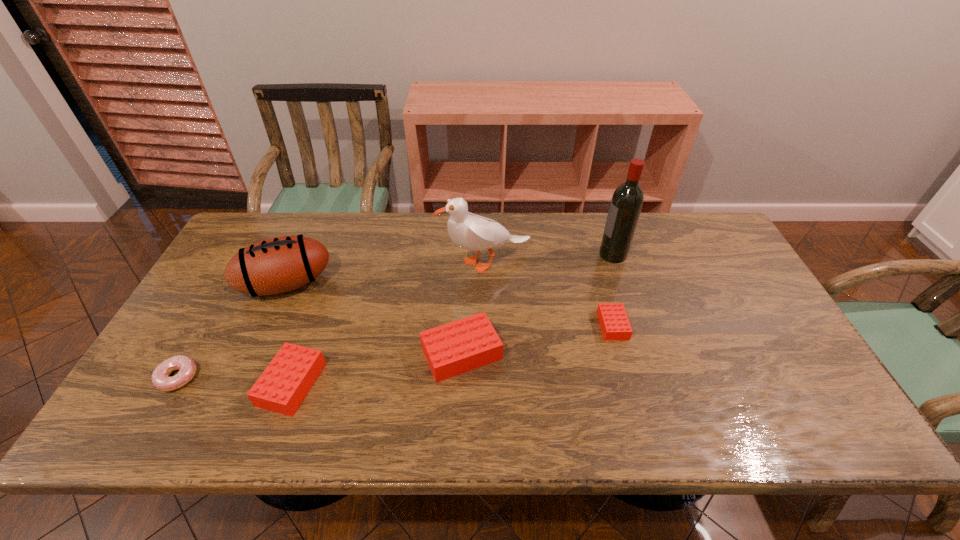
The height and width of the screenshot is (540, 960). What are the coordinates of `the fifth tallest object` in the screenshot? It's located at (281, 388).

Where is `the second tallest Lego`? The width and height of the screenshot is (960, 540). the second tallest Lego is located at coordinates (281, 388).

Identify the location of the second Lego from right to left. Image resolution: width=960 pixels, height=540 pixels. (457, 347).

Identify the location of the rightmost Lego. (614, 322).

Where is `gull`? The image size is (960, 540). gull is located at coordinates (469, 231).

Locate an element on the screen. wine bottle is located at coordinates (627, 200).

Locate an element on the screen. The width and height of the screenshot is (960, 540). the third tallest object is located at coordinates (276, 265).

This screenshot has height=540, width=960. I want to click on doughnut, so click(x=160, y=378).

Find the location of a particular element. The image size is (960, 540). free space located 0.270m on the left of the third shortest object is located at coordinates (150, 384).

You are a GUI agent. You are given a task and a screenshot of the screen. Output one action in this format:
    pyautogui.click(x=<x>, y=<y>)
    Task: Click on the vacant space located 0.250m on the back of the second Lego from right to left
    The height and width of the screenshot is (540, 960).
    Given the screenshot: What is the action you would take?
    pyautogui.click(x=465, y=264)